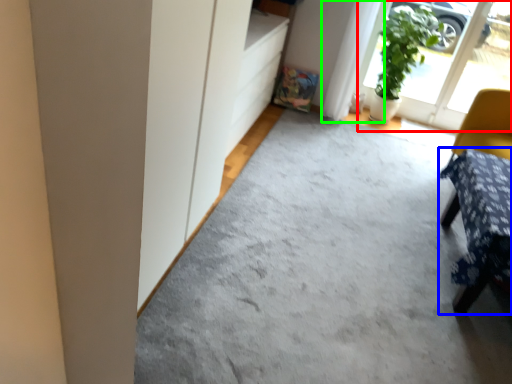
Question: Which object is the closest to the screen door (highlighted by a red box)? Choose among these: furniture (highlighted by a blue box) or curtain (highlighted by a green box).

Choices:
 (A) furniture
 (B) curtain

Answer: (B)